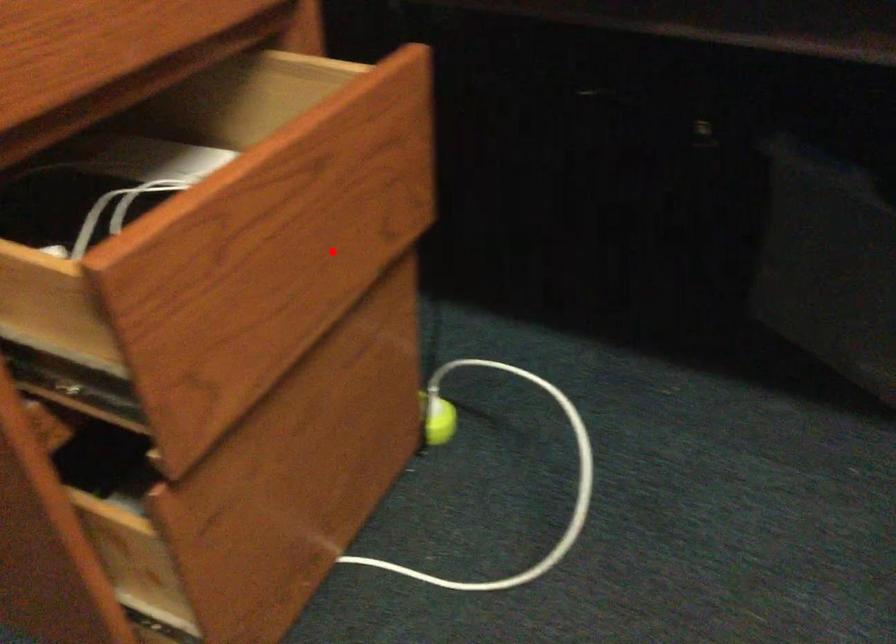
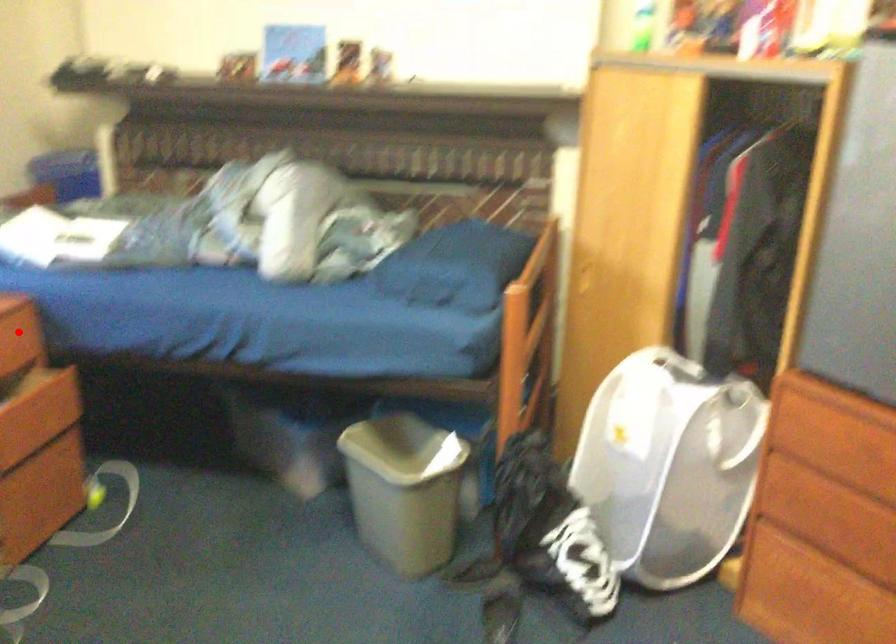
I am providing you with two images of the same scene from different viewpoints. A red point is marked on the first image and another point is marked on the second image. Does the point marked in image1 correspond to the same location as the one in image2?

No